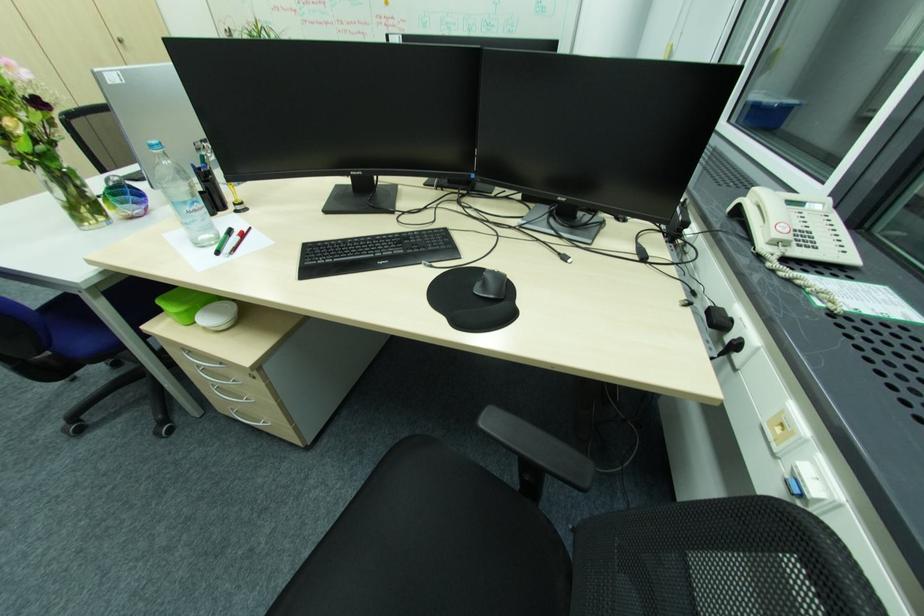
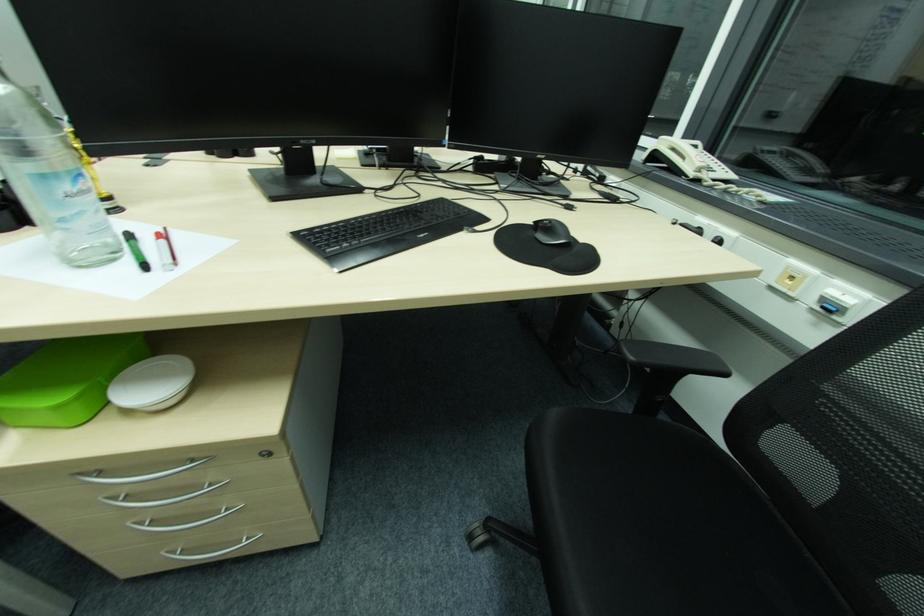
Locate, in the second image, the point that corresponds to (x=225, y=253) in the first image.

(149, 267)